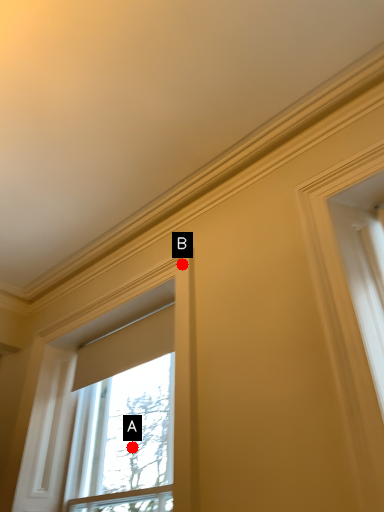
Question: Two points are circled on the image, labeled by A and B beside each circle. Which point is closer to the camera?

Choices:
 (A) A is closer
 (B) B is closer

Answer: (B)